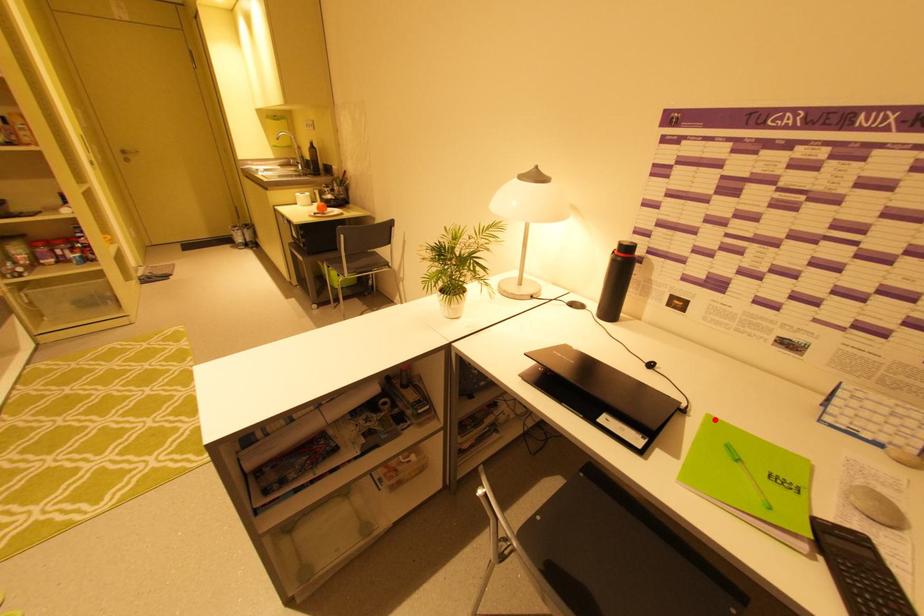
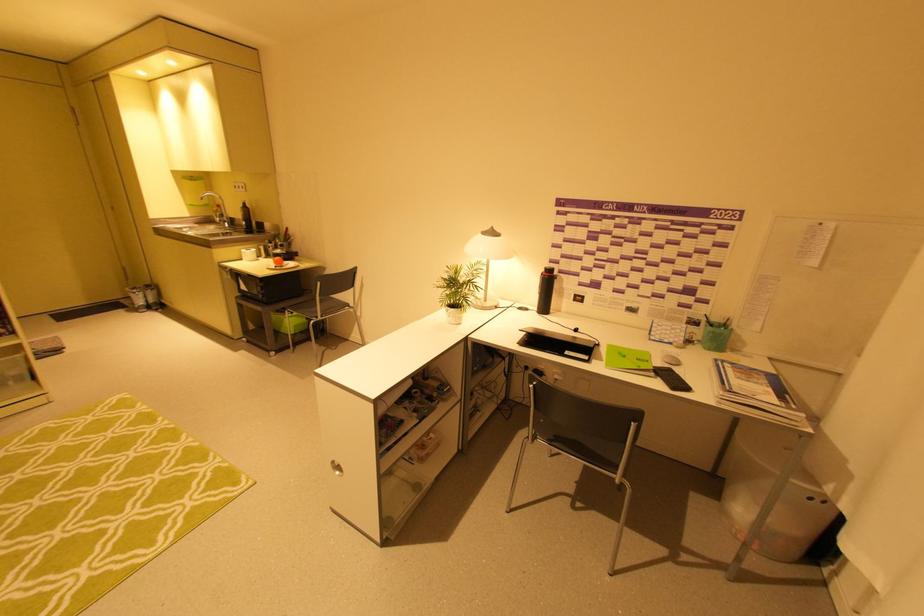
Where in the second image is the point corresponding to the highlighted location from the first image?

(614, 346)